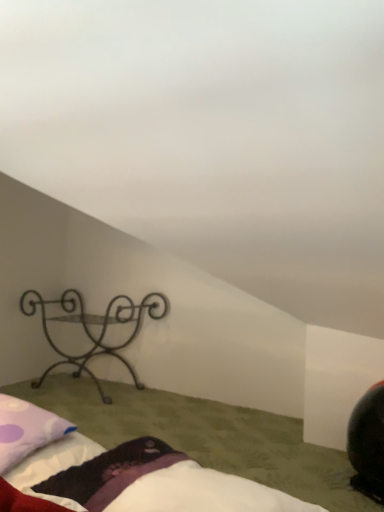
Question: Does black wrought iron shelf at left have a smaller size compared to purple dotted pillow at lower left?

Choices:
 (A) yes
 (B) no

Answer: (B)

Question: Is black wrought iron shelf at left wider than purple dotted pillow at lower left?

Choices:
 (A) no
 (B) yes

Answer: (B)

Question: From the image's perspective, does black wrought iron shelf at left appear higher than purple dotted pillow at lower left?

Choices:
 (A) no
 (B) yes

Answer: (A)

Question: Considering the relative positions of black wrought iron shelf at left and purple dotted pillow at lower left in the image provided, is black wrought iron shelf at left to the right of purple dotted pillow at lower left from the viewer's perspective?

Choices:
 (A) no
 (B) yes

Answer: (A)

Question: Can you confirm if black wrought iron shelf at left is bigger than purple dotted pillow at lower left?

Choices:
 (A) yes
 (B) no

Answer: (A)

Question: From a real-world perspective, is black wrought iron shelf at left positioned above or below purple dotted pillow at lower left?

Choices:
 (A) below
 (B) above

Answer: (A)

Question: Considering the positions of black wrought iron shelf at left and purple dotted pillow at lower left in the image, is black wrought iron shelf at left bigger or smaller than purple dotted pillow at lower left?

Choices:
 (A) big
 (B) small

Answer: (A)

Question: Is black wrought iron shelf at left inside the boundaries of purple dotted pillow at lower left, or outside?

Choices:
 (A) inside
 (B) outside

Answer: (B)

Question: Is black wrought iron shelf at left taller or shorter than purple dotted pillow at lower left?

Choices:
 (A) short
 (B) tall

Answer: (B)

Question: Considering the positions of fluffy white bed at lower center and black wrought iron shelf at left in the image, is fluffy white bed at lower center taller or shorter than black wrought iron shelf at left?

Choices:
 (A) short
 (B) tall

Answer: (A)

Question: Is fluffy white bed at lower center wider or thinner than black wrought iron shelf at left?

Choices:
 (A) wide
 (B) thin

Answer: (A)

Question: Looking at the image, does fluffy white bed at lower center seem bigger or smaller compared to black wrought iron shelf at left?

Choices:
 (A) small
 (B) big

Answer: (A)

Question: From a real-world perspective, is fluffy white bed at lower center positioned above or below black wrought iron shelf at left?

Choices:
 (A) above
 (B) below

Answer: (B)

Question: Is fluffy white bed at lower center taller or shorter than purple dotted pillow at lower left?

Choices:
 (A) tall
 (B) short

Answer: (B)

Question: Looking at their shapes, would you say fluffy white bed at lower center is wider or thinner than purple dotted pillow at lower left?

Choices:
 (A) thin
 (B) wide

Answer: (B)